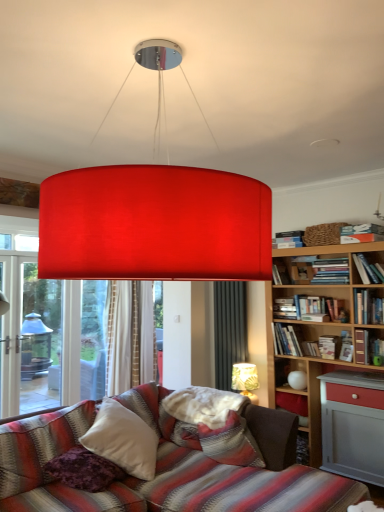
Identify the location of white soft pillow at center, the second pillow in the left-to-right sequence. Image resolution: width=384 pixels, height=512 pixels. (230, 443).

What do you see at coordinates (285, 308) in the screenshot?
I see `hardcover book at upper right, which is counted as the sixth book, starting from the top` at bounding box center [285, 308].

Image resolution: width=384 pixels, height=512 pixels. What do you see at coordinates (154, 224) in the screenshot? I see `matte red lampshade at upper center, arranged as the first lamp when viewed from the top` at bounding box center [154, 224].

Describe the element at coordinates (361, 233) in the screenshot. I see `hardcover book at upper right, which is the 9th book in bottom-to-top order` at that location.

Find the location of `velvet purple pillow at lower left, marked as the first pillow in a left-to-right arrangement`. velvet purple pillow at lower left, marked as the first pillow in a left-to-right arrangement is located at coordinates (84, 470).

The width and height of the screenshot is (384, 512). What do you see at coordinates (84, 470) in the screenshot? I see `velvet purple pillow at lower left, which is the 2th pillow in right-to-left order` at bounding box center [84, 470].

Based on the photo, measure the distance between point (327, 343) and camera.

The depth of point (327, 343) is 3.98 meters.

Image resolution: width=384 pixels, height=512 pixels. What do you see at coordinates (286, 340) in the screenshot?
I see `hardcover book at upper right, which ranks as the second book in bottom-to-top order` at bounding box center [286, 340].

You are a GUI agent. You are given a task and a screenshot of the screen. Output one action in this format:
    pyautogui.click(x=<x>, y=<y>)
    Task: Click on the white soft pillow at center, the second pillow in the left-to-right sequence
    The height and width of the screenshot is (512, 384).
    Given the screenshot: What is the action you would take?
    pyautogui.click(x=230, y=443)

At what (x,y) coordinates should I click in order to perform the action: click on the 2nd book directly beneath the matte red lampshade at upper center, placed as the 2th lamp when sorted from back to front (from a real-world perspective). Please return your answer as a coordinate pair (x, y). The width and height of the screenshot is (384, 512). Looking at the image, I should click on (367, 270).

Who is smaller, hardcover book at upper right, placed as the second book when sorted from top to bottom, or matte red lampshade at upper center, placed as the 2th lamp when sorted from back to front?

Smaller between the two is hardcover book at upper right, placed as the second book when sorted from top to bottom.

From the image's perspective, is hardcover book at upper right, the 8th book ordered from the bottom, above matte red lampshade at upper center, which is the 1th lamp from left to right?

No, from the image's perspective, hardcover book at upper right, the 8th book ordered from the bottom, is not on top of matte red lampshade at upper center, which is the 1th lamp from left to right.

Which object is positioned more to the left, hardcover book at upper right, placed as the second book when sorted from top to bottom, or matte red lampshade at upper center, arranged as the first lamp when viewed from the top?

From the viewer's perspective, matte red lampshade at upper center, arranged as the first lamp when viewed from the top, appears more on the left side.

How different are the orientations of hardcover book at upper right, the fifth book in the bottom-to-top sequence, and hardcover book at upper right, which ranks as the second book in bottom-to-top order, in degrees?

The angular difference between hardcover book at upper right, the fifth book in the bottom-to-top sequence, and hardcover book at upper right, which ranks as the second book in bottom-to-top order, is 0.00087 degrees.

Which object is more forward, hardcover book at upper right, the fifth book in the bottom-to-top sequence, or hardcover book at upper right, acting as the eighth book starting from the top?

hardcover book at upper right, the fifth book in the bottom-to-top sequence, is closer to the camera.

Based on the photo, is hardcover book at upper right, marked as the fifth book in a top-to-bottom arrangement, outside of hardcover book at upper right, acting as the eighth book starting from the top?

That's correct, hardcover book at upper right, marked as the fifth book in a top-to-bottom arrangement, is outside of hardcover book at upper right, acting as the eighth book starting from the top.

Who is taller, hardcover book at upper right, marked as the fifth book in a top-to-bottom arrangement, or hardcover book at upper right, which ranks as the second book in bottom-to-top order?

hardcover book at upper right, which ranks as the second book in bottom-to-top order, is taller.

Which object is positioned more to the left, matte gold lampshade at lower right, the 1th lamp positioned from the back, or velvet purple pillow at lower left, marked as the first pillow in a left-to-right arrangement?

Positioned to the left is velvet purple pillow at lower left, marked as the first pillow in a left-to-right arrangement.

From the picture: Is velvet purple pillow at lower left, marked as the first pillow in a left-to-right arrangement, at the back of matte gold lampshade at lower right, the second lamp viewed from the front?

No, matte gold lampshade at lower right, the second lamp viewed from the front, is not facing away from velvet purple pillow at lower left, marked as the first pillow in a left-to-right arrangement.

Is matte gold lampshade at lower right, the 2th lamp positioned from the left, positioned behind velvet purple pillow at lower left, marked as the first pillow in a left-to-right arrangement?

Yes, it is behind velvet purple pillow at lower left, marked as the first pillow in a left-to-right arrangement.

Which object is more forward, hardcover book at upper right, which is the 9th book in bottom-to-top order, or hardcover book at upper right, which ranks as the second book in bottom-to-top order?

Positioned in front is hardcover book at upper right, which is the 9th book in bottom-to-top order.

Based on the photo, choose the correct answer: Is hardcover book at upper right, which is the 9th book in bottom-to-top order, inside hardcover book at upper right, which ranks as the second book in bottom-to-top order, or outside it?

hardcover book at upper right, which is the 9th book in bottom-to-top order, is outside hardcover book at upper right, which ranks as the second book in bottom-to-top order.

Is hardcover book at upper right, positioned as the 1th book in top-to-bottom order, turned away from hardcover book at upper right, which ranks as the second book in bottom-to-top order?

hardcover book at upper right, positioned as the 1th book in top-to-bottom order, does not have its back to hardcover book at upper right, which ranks as the second book in bottom-to-top order.

Between hardcover book at upper right, which is the 9th book in bottom-to-top order, and hardcover book at upper right, which ranks as the second book in bottom-to-top order, which one appears on the left side from the viewer's perspective?

hardcover book at upper right, which ranks as the second book in bottom-to-top order, is more to the left.

From the image's perspective, is hardcover books at upper right, which is counted as the seventh book, starting from the bottom, above hardcover book at upper right, placed as the second book when sorted from top to bottom?

Incorrect, from the image's perspective, hardcover books at upper right, which is counted as the seventh book, starting from the bottom, is lower than hardcover book at upper right, placed as the second book when sorted from top to bottom.

Is hardcover books at upper right, positioned as the third book in top-to-bottom order, to the right of hardcover book at upper right, the 8th book ordered from the bottom, from the viewer's perspective?

Incorrect, hardcover books at upper right, positioned as the third book in top-to-bottom order, is not on the right side of hardcover book at upper right, the 8th book ordered from the bottom.

From the picture: Which of these two, hardcover books at upper right, which is counted as the seventh book, starting from the bottom, or hardcover book at upper right, placed as the second book when sorted from top to bottom, is wider?

hardcover book at upper right, placed as the second book when sorted from top to bottom.

Which point is more distant from viewer, (323, 268) or (365, 267)?

The point (323, 268) is behind.

In the image, is white soft pillow at center, the second pillow in the left-to-right sequence, on the left side or the right side of hardcover book at upper right, the 4th book from the top?

From the image, it's evident that white soft pillow at center, the second pillow in the left-to-right sequence, is to the left of hardcover book at upper right, the 4th book from the top.

From the image's perspective, is white soft pillow at center, which is the 1th pillow from right to left, over hardcover book at upper right, which is the sixth book from bottom to top?

Incorrect, from the image's perspective, white soft pillow at center, which is the 1th pillow from right to left, is lower than hardcover book at upper right, which is the sixth book from bottom to top.

Which is behind, point (260, 462) or point (274, 277)?

The point (274, 277) is behind.

From a real-world perspective, relative to hardcover book at upper right, which is the sixth book from bottom to top, is white soft pillow at center, which is the 1th pillow from right to left, vertically above or below?

Clearly, from a real-world perspective, white soft pillow at center, which is the 1th pillow from right to left, is below hardcover book at upper right, which is the sixth book from bottom to top.

Is white soft pillow at center, the second pillow in the left-to-right sequence, positioned far away from matte red lampshade at upper center, arranged as the first lamp when viewed from the top?

Yes.

From a real-world perspective, is white soft pillow at center, the second pillow in the left-to-right sequence, positioned above or below matte red lampshade at upper center, the second lamp positioned from the right?

white soft pillow at center, the second pillow in the left-to-right sequence, is below matte red lampshade at upper center, the second lamp positioned from the right.

Does white soft pillow at center, which is the 1th pillow from right to left, appear on the left side of matte red lampshade at upper center, the 2th lamp from the bottom?

Incorrect, white soft pillow at center, which is the 1th pillow from right to left, is not on the left side of matte red lampshade at upper center, the 2th lamp from the bottom.

Between white soft pillow at center, which is the 1th pillow from right to left, and matte red lampshade at upper center, the second lamp positioned from the right, which one has larger size?

matte red lampshade at upper center, the second lamp positioned from the right.

Where is `lamp that is in front of the hardcover book at upper right, the 8th book ordered from the bottom`? This screenshot has width=384, height=512. lamp that is in front of the hardcover book at upper right, the 8th book ordered from the bottom is located at coordinates (154, 224).

At what (x,y) coordinates should I click in order to perform the action: click on the 3rd book positioned above the hardcover book at upper right, acting as the eighth book starting from the top (from the image's perspective). Please return your answer as a coordinate pair (x, y). This screenshot has width=384, height=512. Looking at the image, I should click on (367, 307).

Based on their spatial positions, is hardcover book at upper right, which is counted as the sixth book, starting from the top, or white soft pillow at center, the second pillow in the left-to-right sequence, closer to hardcover book at upper right, placed as the second book when sorted from top to bottom?

Based on the image, hardcover book at upper right, which is counted as the sixth book, starting from the top, appears to be nearer to hardcover book at upper right, placed as the second book when sorted from top to bottom.

Which object lies nearer to the anchor point matte red lampshade at upper center, arranged as the first lamp when viewed from the top, hardcover book at upper right, which ranks as the second book in bottom-to-top order, or hardcover book at upper right, the 4th book from the top?

Among the two, hardcover book at upper right, which ranks as the second book in bottom-to-top order, is located nearer to matte red lampshade at upper center, arranged as the first lamp when viewed from the top.

Based on their spatial positions, is hardcover book at upper right, marked as the fifth book in a top-to-bottom arrangement, or hardcover book at upper right, the 8th book ordered from the bottom, further from hardcover book at upper right, positioned as the fourth book in bottom-to-top order?

The object further to hardcover book at upper right, positioned as the fourth book in bottom-to-top order, is hardcover book at upper right, the 8th book ordered from the bottom.

Looking at the image, which one is located further to hardcover book at upper right, positioned as the 1th book in top-to-bottom order, matte red lampshade at upper center, marked as the first lamp in a front-to-back arrangement, or hardcover book at upper right, positioned as the fourth book in bottom-to-top order?

matte red lampshade at upper center, marked as the first lamp in a front-to-back arrangement, lies further to hardcover book at upper right, positioned as the 1th book in top-to-bottom order, than the other object.

Based on their spatial positions, is hardcover book at upper right, acting as the eighth book starting from the top, or hardcover book at upper right, which is the sixth book from bottom to top, further from matte gold lampshade at lower right, placed as the 1th lamp when sorted from bottom to top?

hardcover book at upper right, which is the sixth book from bottom to top, is positioned further to the anchor matte gold lampshade at lower right, placed as the 1th lamp when sorted from bottom to top.

When comparing their distances from white soft pillow at center, which is the 1th pillow from right to left, does hardcover book at upper right, positioned as the 1th book in top-to-bottom order, or hardcover book at upper right, which is counted as the 1th book, starting from the bottom, seem closer?

hardcover book at upper right, which is counted as the 1th book, starting from the bottom.

Based on their spatial positions, is hardcover book at upper right, placed as the second book when sorted from top to bottom, or hardcover book at upper right, marked as the fifth book in a top-to-bottom arrangement, further from hardcover book at upper right, the 4th book from the top?

hardcover book at upper right, marked as the fifth book in a top-to-bottom arrangement, is further to hardcover book at upper right, the 4th book from the top.

Looking at the image, which one is located further to velvet purple pillow at lower left, which is the 2th pillow in right-to-left order, hardcover book at upper right, positioned as the fourth book in bottom-to-top order, or white soft pillow at center, the second pillow in the left-to-right sequence?

hardcover book at upper right, positioned as the fourth book in bottom-to-top order, lies further to velvet purple pillow at lower left, which is the 2th pillow in right-to-left order, than the other object.

Identify the location of pillow situated between velvet purple pillow at lower left, marked as the first pillow in a left-to-right arrangement, and hardcover books at upper right, positioned as the third book in top-to-bottom order, from left to right. (230, 443).

Where is `pillow between velvet purple pillow at lower left, which is the 2th pillow in right-to-left order, and matte gold lampshade at lower right, which appears as the 1th lamp when viewed from the right, from front to back`? pillow between velvet purple pillow at lower left, which is the 2th pillow in right-to-left order, and matte gold lampshade at lower right, which appears as the 1th lamp when viewed from the right, from front to back is located at coordinates click(x=230, y=443).

Find the location of a particular element. Image resolution: width=384 pixels, height=512 pixels. pillow located between velvet purple pillow at lower left, which is the 2th pillow in right-to-left order, and hardcover book at upper right, which ranks as the second book in bottom-to-top order, in the left-right direction is located at coordinates (230, 443).

Locate an element on the screen. The image size is (384, 512). book between matte red lampshade at upper center, the 2th lamp from the bottom, and hardcover book at upper right, the 8th book ordered from the bottom, along the z-axis is located at coordinates (361, 233).